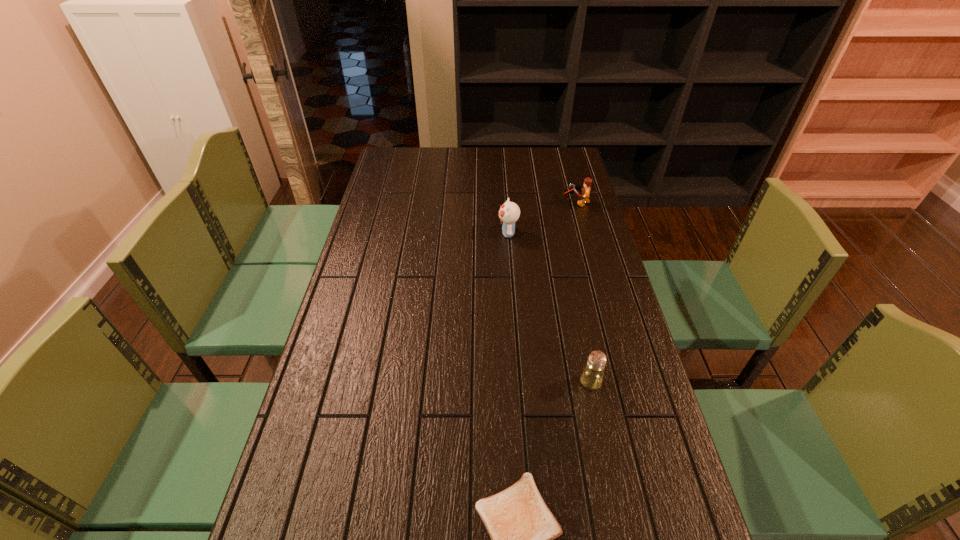
Where is `free point between the second nearest object and the second farthest object`? Image resolution: width=960 pixels, height=540 pixels. free point between the second nearest object and the second farthest object is located at coordinates (549, 307).

The image size is (960, 540). I want to click on free point between the third nearest object and the third farthest object, so click(x=549, y=307).

What are the coordinates of `object that is the second closest to the kitten` in the screenshot? It's located at (592, 376).

You are a GUI agent. You are given a task and a screenshot of the screen. Output one action in this format:
    pyautogui.click(x=<x>, y=<y>)
    Task: Click on the object that ranks as the closest to the saltshaker
    This screenshot has height=540, width=960.
    Given the screenshot: What is the action you would take?
    pyautogui.click(x=522, y=528)

At what (x,y) coordinates should I click in order to perform the action: click on vacant position in the image that satisfies the following two spatial constraints: 1. holding a crossbow in the hands of the Lego; 2. on the front side of the third object from left to right. Please return your answer as a coordinate pair (x, y). Looking at the image, I should click on (625, 382).

Identify the location of vacant space that satisfies the following two spatial constraints: 1. on the front-facing side of the second farthest object; 2. on the left side of the second nearest object. The image size is (960, 540). (518, 382).

The width and height of the screenshot is (960, 540). Find the location of `vacant space that satisfies the following two spatial constraints: 1. on the back side of the second object from right to left; 2. on the front-facing side of the second farthest object`. vacant space that satisfies the following two spatial constraints: 1. on the back side of the second object from right to left; 2. on the front-facing side of the second farthest object is located at coordinates (560, 233).